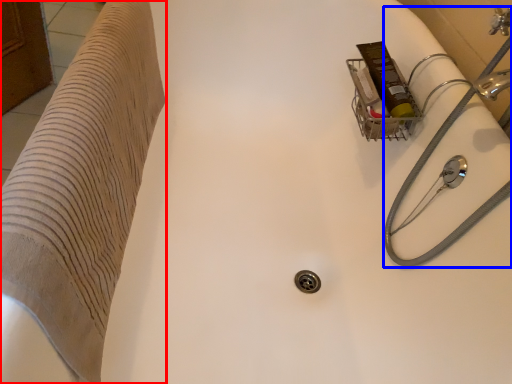
Question: Which object appears farthest to the camera in this image, furniture (highlighted by a red box) or water pipe (highlighted by a blue box)?

Choices:
 (A) furniture
 (B) water pipe

Answer: (B)